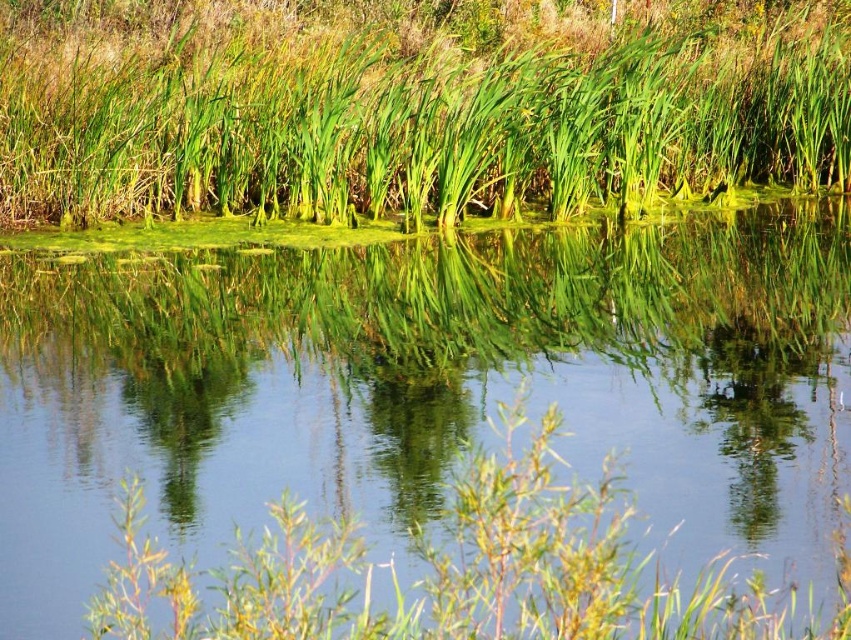
You are standing at the edge of the water and want to pick both the green grass at center and the green glossy reeds at center. Which one can you reach without wading into the water?

The green grass at center is closer to the viewer than the green glossy reeds at center, so you can reach the green grass at center without wading into the water, but the green glossy reeds at center would require moving further into the water.

You are standing at the edge of the green grassy lake at upper center and looking towards the green grass at upper center. Which object is closer to you?

The green grassy lake at upper center is closer to you than the green grass at upper center.

You are a photographer standing at the edge of the green grassy lake at upper center and want to capture a shot of the green grass at center. Based on their relative heights, which object will appear larger in the photo?

The green grassy lake at upper center will appear larger in the photo because it is much taller than the green grass at center.